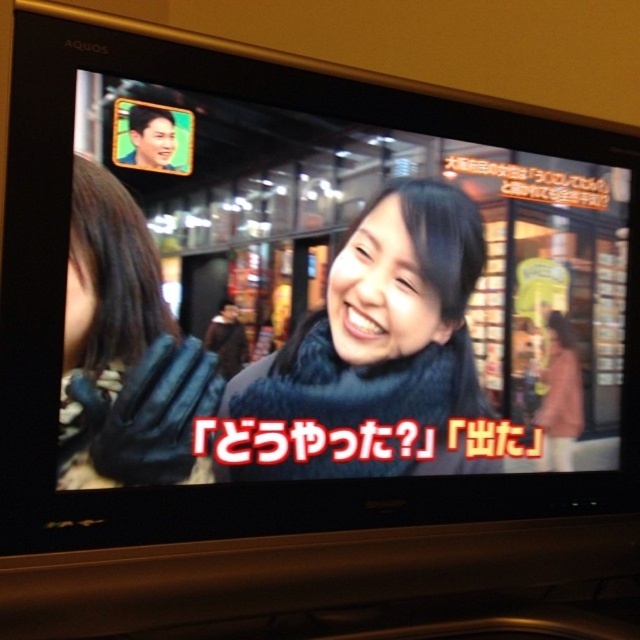
Question: Which point is closer to the camera?

Choices:
 (A) (474, 397)
 (B) (86, 380)

Answer: (B)

Question: Which object appears closest to the camera in this image?

Choices:
 (A) blue fuzzy scarf at center
 (B) blue fuzzy gloves at left

Answer: (B)

Question: Which point appears closest to the camera in this image?

Choices:
 (A) (160, 426)
 (B) (344, 307)

Answer: (A)

Question: Is blue fuzzy scarf at center above blue fuzzy gloves at left?

Choices:
 (A) no
 (B) yes

Answer: (A)

Question: Does blue fuzzy scarf at center appear on the right side of blue fuzzy gloves at left?

Choices:
 (A) yes
 (B) no

Answer: (A)

Question: Does blue fuzzy scarf at center have a larger size compared to blue fuzzy gloves at left?

Choices:
 (A) yes
 (B) no

Answer: (A)